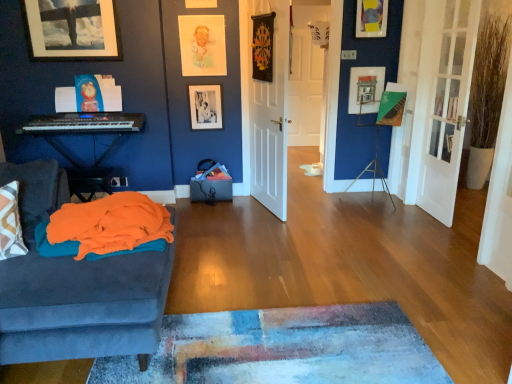
Question: Could you tell me if white wooden door at center, the 2th door when ordered from right to left, is turned towards orange soft fabric blanket at left?

Choices:
 (A) yes
 (B) no

Answer: (B)

Question: Is white wooden door at center, the 2th door when ordered from right to left, further to camera compared to orange soft fabric blanket at left?

Choices:
 (A) yes
 (B) no

Answer: (A)

Question: Can you confirm if white wooden door at center, the first door viewed from the back, is taller than orange soft fabric blanket at left?

Choices:
 (A) yes
 (B) no

Answer: (A)

Question: Does white wooden door at center, the 3th door from the front, have a lesser width compared to orange soft fabric blanket at left?

Choices:
 (A) no
 (B) yes

Answer: (B)

Question: Can you confirm if white wooden door at center, the 2th door viewed from the left, is wider than orange soft fabric blanket at left?

Choices:
 (A) no
 (B) yes

Answer: (A)

Question: Is white wooden door at center, the 2th door viewed from the left, closer to the viewer compared to orange soft fabric blanket at left?

Choices:
 (A) no
 (B) yes

Answer: (A)

Question: Is matte black picture frame at upper left, the 1th picture frame from the left, next to matte black keyboard at left?

Choices:
 (A) yes
 (B) no

Answer: (B)

Question: Can you confirm if matte black picture frame at upper left, which ranks as the fifth picture frame in right-to-left order, is bigger than matte black keyboard at left?

Choices:
 (A) no
 (B) yes

Answer: (A)

Question: From the image's perspective, is matte black picture frame at upper left, the 1th picture frame from the left, on top of matte black keyboard at left?

Choices:
 (A) no
 (B) yes

Answer: (B)

Question: Is matte black picture frame at upper left, which ranks as the fifth picture frame in right-to-left order, to the right of matte black keyboard at left from the viewer's perspective?

Choices:
 (A) yes
 (B) no

Answer: (B)

Question: From the image's perspective, would you say matte black picture frame at upper left, which ranks as the fifth picture frame in right-to-left order, is shown under matte black keyboard at left?

Choices:
 (A) no
 (B) yes

Answer: (A)

Question: Does matte black picture frame at upper left, the 1th picture frame from the left, have a greater width compared to matte black keyboard at left?

Choices:
 (A) no
 (B) yes

Answer: (A)

Question: Are white matte door at center, acting as the second door starting from the back, and pastel paper portrait at upper center, which is counted as the third picture frame, starting from the right, far apart?

Choices:
 (A) no
 (B) yes

Answer: (A)